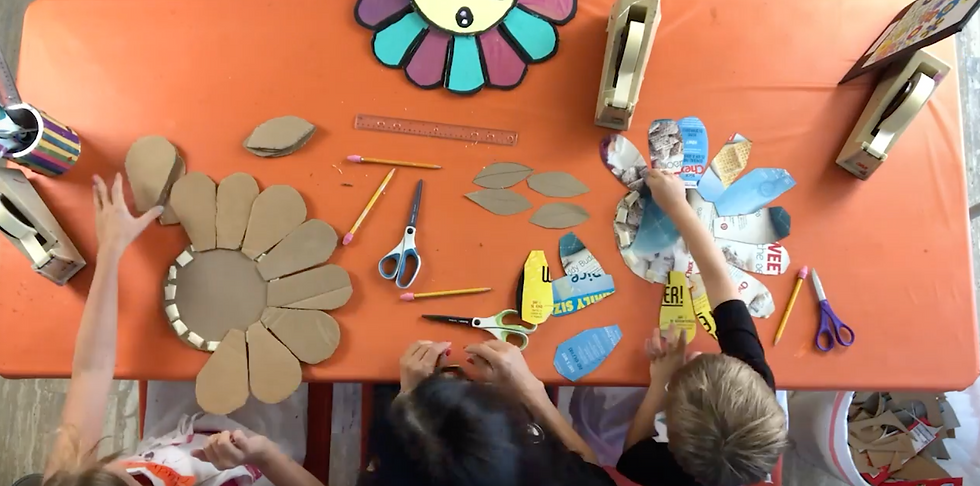
Where is `erasers`? The height and width of the screenshot is (486, 980). erasers is located at coordinates (346, 240), (357, 158), (804, 272), (412, 298).